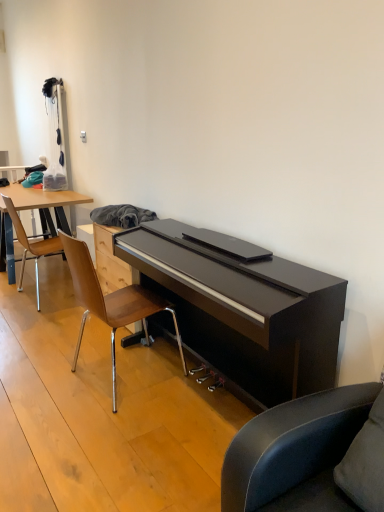
Question: Relative to wooden/metallic chair at center, positioned as the second chair in left-to-right order, is wooden polished chair at left, positioned as the 1th chair in back-to-front order, in front or behind?

Choices:
 (A) front
 (B) behind

Answer: (B)

Question: In the image, is wooden polished chair at left, positioned as the 1th chair in back-to-front order, on the left side or the right side of wooden/metallic chair at center, which appears as the 1th chair when viewed from the front?

Choices:
 (A) right
 (B) left

Answer: (B)

Question: Is wooden polished chair at left, positioned as the 1th chair in back-to-front order, situated inside wooden/metallic chair at center, the 2th chair positioned from the back, or outside?

Choices:
 (A) outside
 (B) inside

Answer: (A)

Question: In terms of size, does wooden/metallic chair at center, the 2th chair positioned from the back, appear bigger or smaller than wooden polished chair at left, which is counted as the second chair, starting from the front?

Choices:
 (A) small
 (B) big

Answer: (B)

Question: Based on their positions, is wooden/metallic chair at center, positioned as the second chair in left-to-right order, located to the left or right of wooden polished chair at left, which is counted as the second chair, starting from the front?

Choices:
 (A) left
 (B) right

Answer: (B)

Question: In the image, is wooden/metallic chair at center, positioned as the second chair in left-to-right order, positioned in front of or behind wooden polished chair at left, which appears as the 1th chair when viewed from the left?

Choices:
 (A) front
 (B) behind

Answer: (A)

Question: In terms of height, does wooden/metallic chair at center, which appears as the 1th chair when viewed from the front, look taller or shorter compared to wooden polished chair at left, which is counted as the second chair, starting from the front?

Choices:
 (A) short
 (B) tall

Answer: (B)